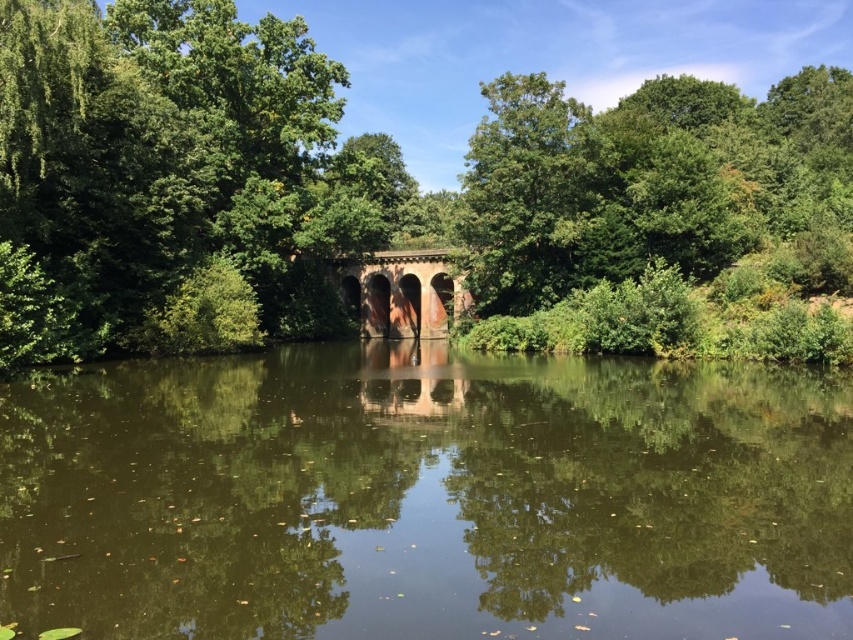
From the picture: You are a bird flying over the scene. You want to land on the closest object between the green leafy tree at center and the rustic stone bridge at center. Which object should you choose?

The green leafy tree at center is 31.48 feet away from the rustic stone bridge at center. Since the bird is flying over the scene, both objects are directly below. To land on the closest one, the bird must choose the one nearest to its current position. However, without knowing the bird exact location, it cannot be determined which is closer. Therefore, the question lacks sufficient information to determine the closest object.

You are standing on the stone bridge in the scene and looking down. Where exactly is the green reflective water at center located in relation to your position?

The green reflective water at center is located directly below you at point coordinates (x=427, y=499).

You are standing on the stone bridge in the center of the image. Looking down, you notice the green reflective water at center. Where is it located relative to your position?

The green reflective water at center is located directly below you at point coordinates (427, 499).